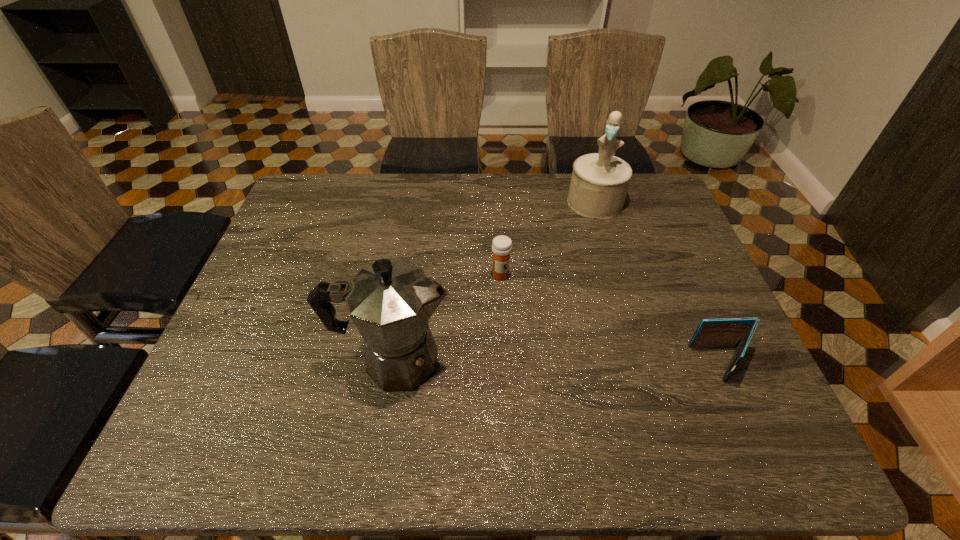
You are a GUI agent. You are given a task and a screenshot of the screen. Output one action in this format:
    pyautogui.click(x=<x>, y=<y>)
    Task: Click on the free spot located on the exterior surface of the wallet
    The image size is (960, 540).
    Given the screenshot: What is the action you would take?
    pyautogui.click(x=663, y=363)

At what (x,y) coordinates should I click in order to perform the action: click on free space located on the label side of the second object from left to right. Please return your answer as a coordinate pair (x, y). This screenshot has height=540, width=960. Looking at the image, I should click on (562, 363).

In order to click on vacant area located 0.140m on the label side of the second object from left to right in this screenshot , I will do `click(531, 319)`.

This screenshot has height=540, width=960. Find the location of `vacant space situated 0.340m on the label side of the second object from left to right`. vacant space situated 0.340m on the label side of the second object from left to right is located at coordinates (577, 384).

Where is `vacant space located at the beak of the figurine`? This screenshot has width=960, height=540. vacant space located at the beak of the figurine is located at coordinates (574, 273).

You are a GUI agent. You are given a task and a screenshot of the screen. Output one action in this format:
    pyautogui.click(x=<x>, y=<y>)
    Task: Click on the vacant space situated at the beak of the figurine
    
    Given the screenshot: What is the action you would take?
    pyautogui.click(x=573, y=275)

Find the location of a particular element. This screenshot has width=960, height=540. vacant space located 0.390m at the beak of the figurine is located at coordinates (563, 310).

Locate an element on the screen. object at the far edge is located at coordinates (599, 183).

This screenshot has height=540, width=960. I want to click on coffeepot that is at the near edge, so click(x=390, y=302).

You are a GUI agent. You are given a task and a screenshot of the screen. Output one action in this format:
    pyautogui.click(x=<x>, y=<y>)
    Task: Click on the wallet situated at the near edge
    The image size is (960, 540).
    Given the screenshot: What is the action you would take?
    pyautogui.click(x=731, y=332)